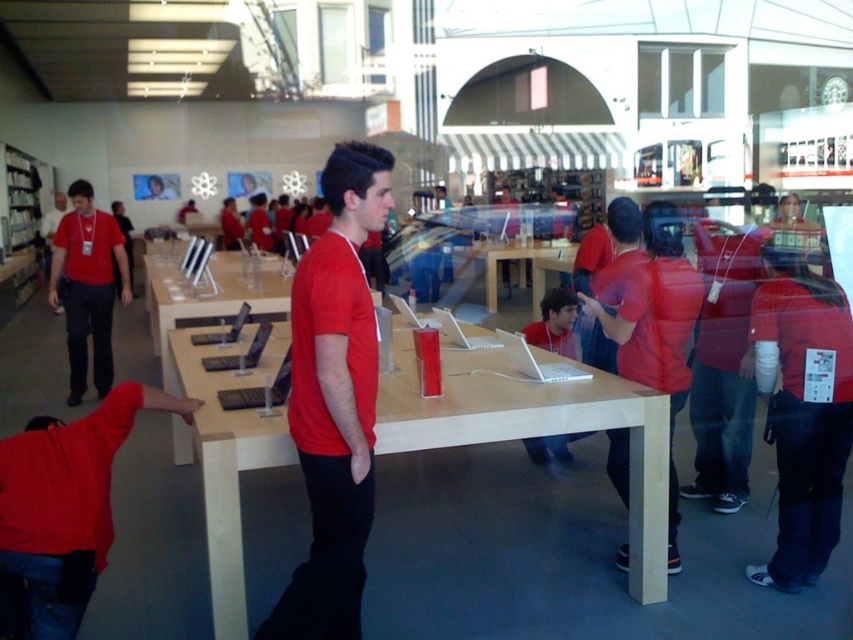
You are a customer in the Apple Store and want to approach the employee wearing the matte red shirt at right. From your current position at the wooden table at center, which direction should you move to reach the employee?

The matte red shirt at right is to the left of the wooden table at center, so you should move to your left to reach the employee.

You are a customer in the Apple Store and want to ask a question to the nearest employee. Which employee, the matte red shirt at lower left or the matte red shirt at left, is closer to you?

The matte red shirt at lower left is closer to the viewer than the matte red shirt at left, so you should ask the matte red shirt at lower left.